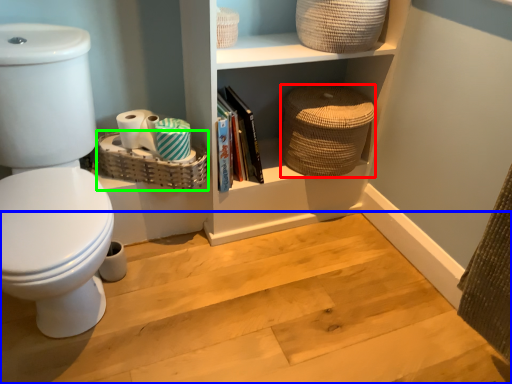
Question: Which is nearer to the basket (highlighted by a red box)? stair (highlighted by a blue box) or basket (highlighted by a green box).

Choices:
 (A) stair
 (B) basket

Answer: (B)